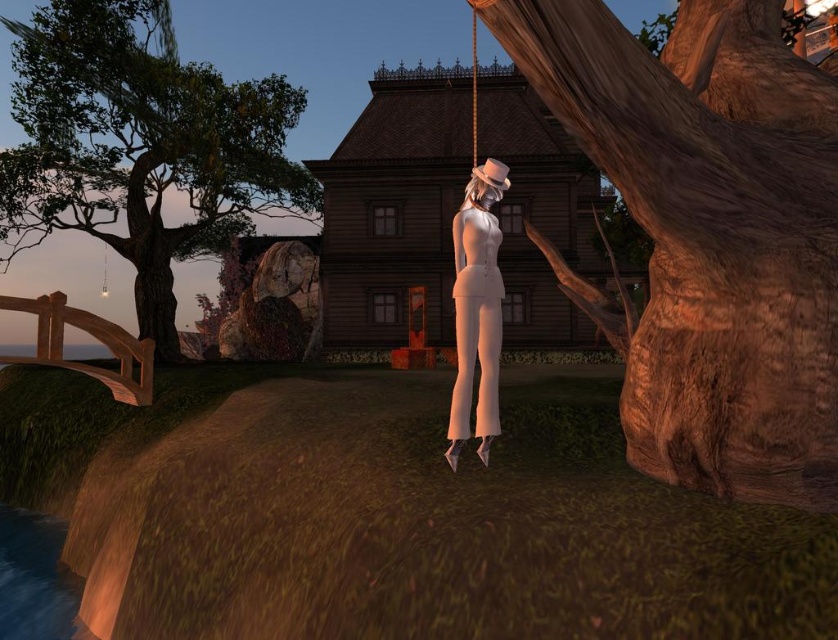
You are an observer in this surreal twilight scene. You notice the green leafy tree at left and the white matte suit at center. Which object takes up more space in the image?

The green leafy tree at left is larger in size than the white matte suit at center, so it takes up more space in the image.

You are an explorer navigating through this surreal environment. You notice the smooth brown bark at center right and the green leafy tree at left. Which object is closer to you, the observer?

The smooth brown bark at center right is closer to you because it is positioned in front of the green leafy tree at left.

You are a character in a game who needs to jump from the green leafy tree at left to the white matte suit at center. Can you make the jump if your maximum jump distance is 20 meters?

The green leafy tree at left and the white matte suit at center are 19.26 meters apart, so yes, you can make the jump as your maximum jump distance is 20 meters.